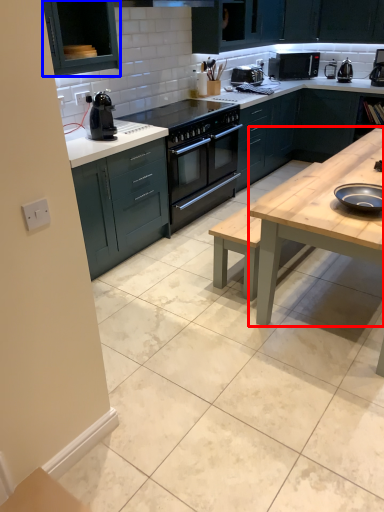
Question: Among these objects, which one is farthest to the camera, table (highlighted by a red box) or cabinetry (highlighted by a blue box)?

Choices:
 (A) table
 (B) cabinetry

Answer: (B)